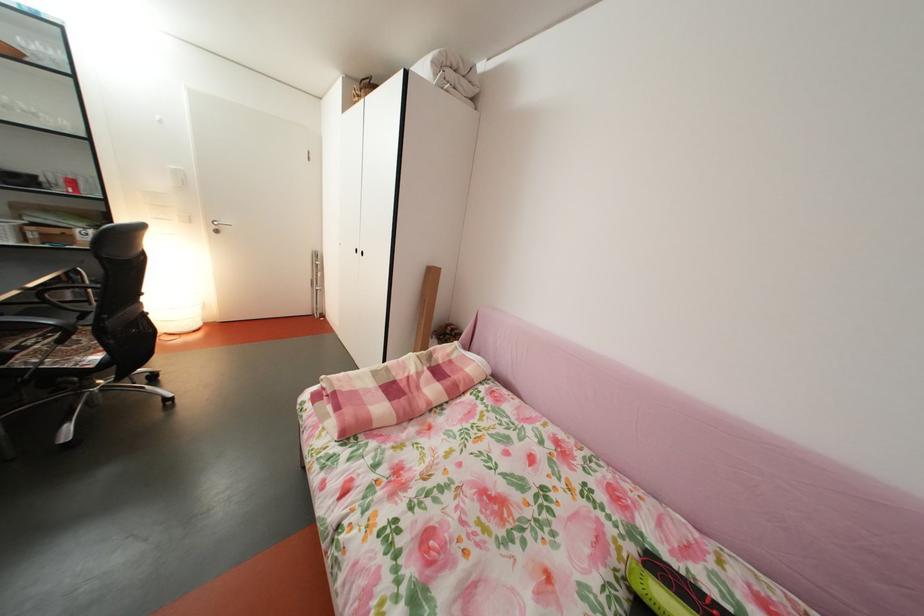
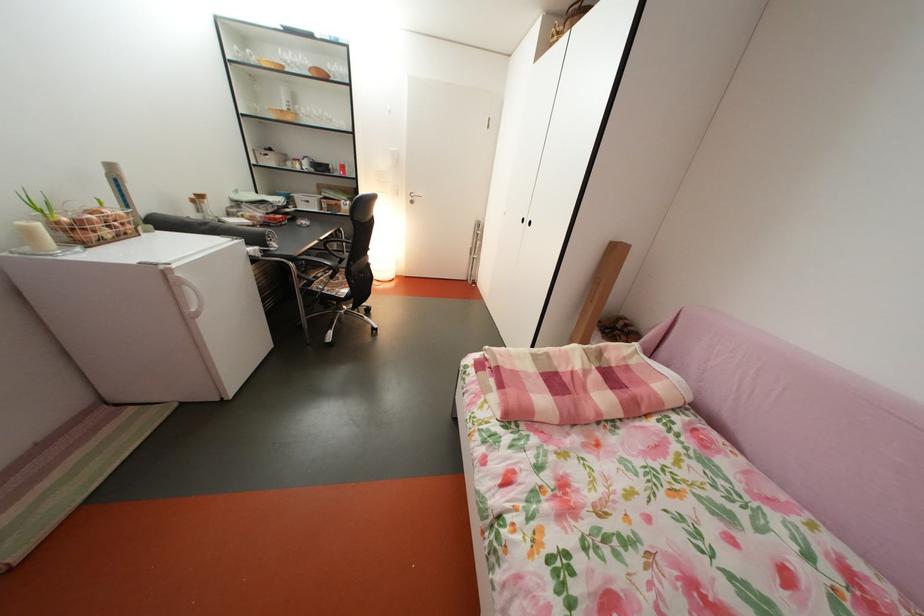
Question: The camera is either moving clockwise (left) or counter-clockwise (right) around the object. The first image is from the beginning of the video and the second image is from the end. Is the camera moving left or right when shooting the video?

Choices:
 (A) Left
 (B) Right

Answer: (B)